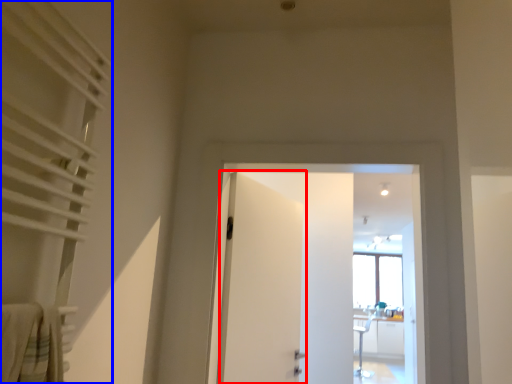
Question: Among these objects, which one is nearest to the camera, door (highlighted by a red box) or curtain (highlighted by a blue box)?

Choices:
 (A) door
 (B) curtain

Answer: (B)